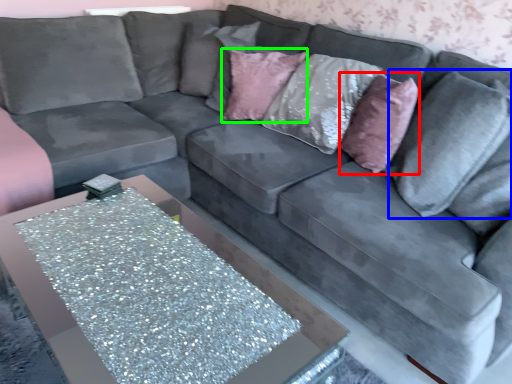
Question: Which object is positioned farthest from throw pillow (highlighted by a red box)? Select from pillow (highlighted by a blue box) and pillow (highlighted by a green box).

Choices:
 (A) pillow
 (B) pillow

Answer: (B)